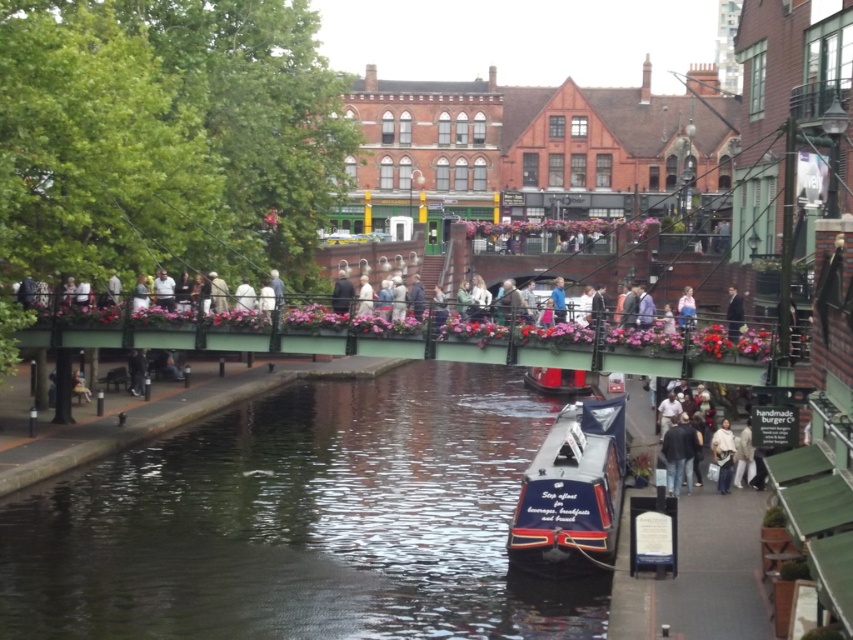
You are standing on the pedestrian bridge and want to take a photo of the two points mentioned. Which point, point (236,630) or point (729,456), will appear larger in your camera view?

Point (236,630) will appear larger in the camera view because it is closer to the viewer than point (729,456).

You are standing at the camera position observing the lively urban scene. There is a specific point marked at coordinates point (584,390). Can you determine if this point is within a safe distance for a drone to capture a closeup shot, considering the drone has a maximum safe operational distance of 300 feet?

The point (584,390) is 319.07 feet away from the camera, which exceeds the drone maximum safe operational distance of 300 feet. Therefore, the drone cannot safely capture a closeup shot of this point.

You are a photographer standing at the edge of the canal, and you want to take a photo of the light brown leather jacket at center. The camera you are using has a maximum focus range of 200 feet. Can you capture the jacket clearly?

The light brown leather jacket at center is 224.76 feet away from the camera, which exceeds the maximum focus range of 200 feet. Therefore, the jacket cannot be captured clearly.